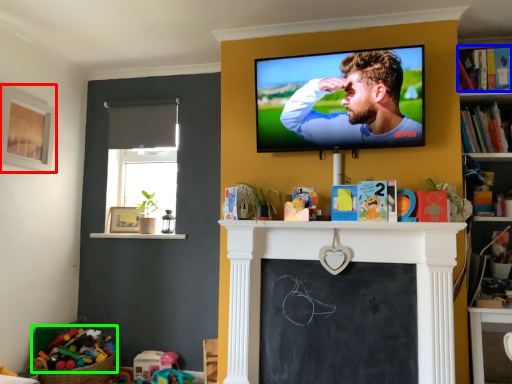
Question: Which object is the farthest from picture frame (highlighted by a red box)? Choose among these: book (highlighted by a blue box) or toy (highlighted by a green box).

Choices:
 (A) book
 (B) toy

Answer: (A)